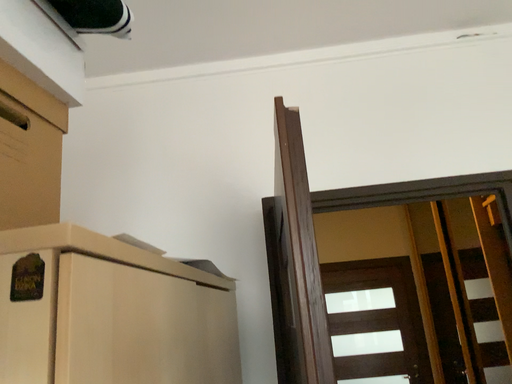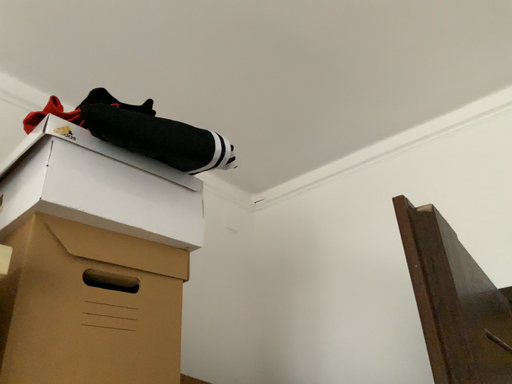
Question: Which way did the camera rotate in the video?

Choices:
 (A) rotated right
 (B) rotated left

Answer: (B)